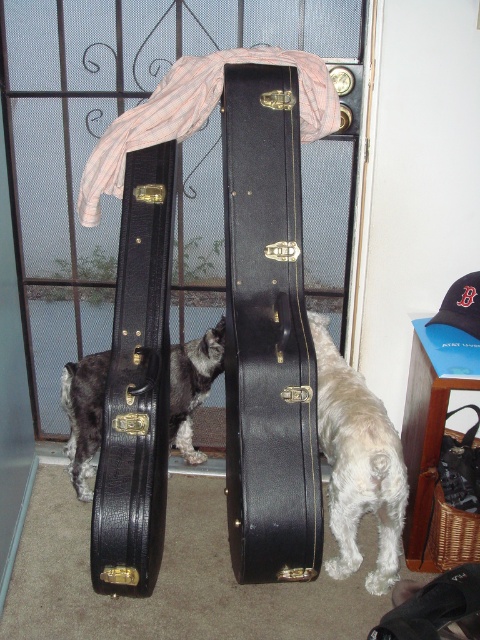
Question: Does black leather guitar case at center appear on the left side of shaggy white dog at center?

Choices:
 (A) no
 (B) yes

Answer: (A)

Question: Which object is the farthest from the black leather guitar case at center?

Choices:
 (A) shaggy white dog at center
 (B) black leather guitar case at left

Answer: (A)

Question: Which point is farther to the camera?

Choices:
 (A) (80, 385)
 (B) (354, 442)

Answer: (A)

Question: Can you confirm if black leather guitar case at center is smaller than shaggy white dog at center?

Choices:
 (A) no
 (B) yes

Answer: (B)

Question: Among these objects, which one is nearest to the camera?

Choices:
 (A) shaggy white dog at center
 (B) black leather guitar case at center
 (C) black leather guitar case at left

Answer: (B)

Question: Is white fluffy dog at lower right to the left of shaggy white dog at center from the viewer's perspective?

Choices:
 (A) yes
 (B) no

Answer: (B)